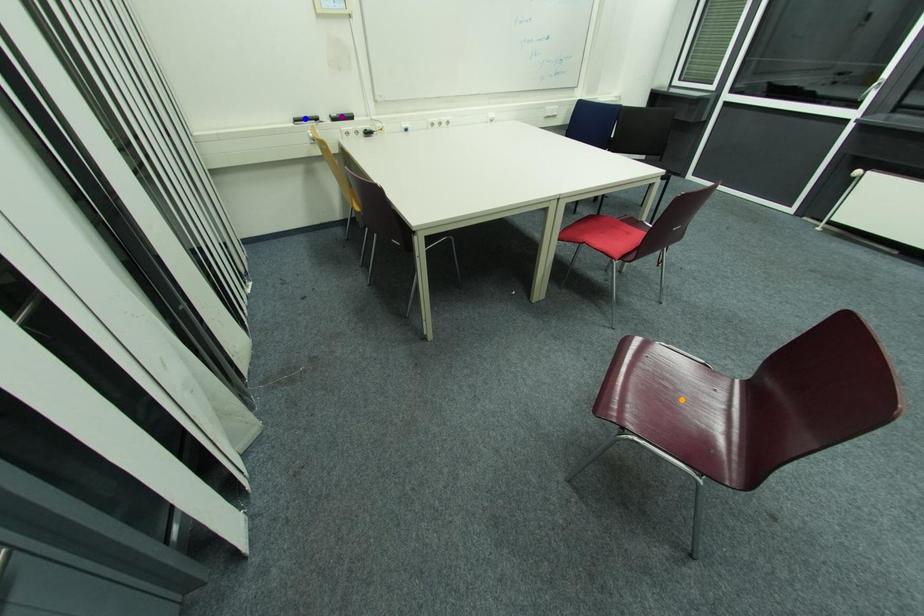
Order these from nearest to farthest:
orange point | purple point | blue point

1. orange point
2. blue point
3. purple point